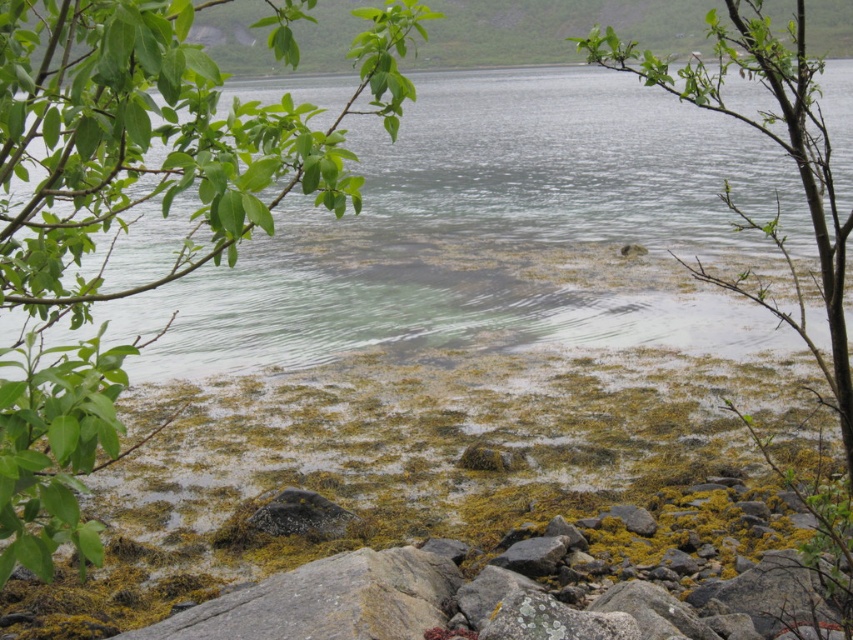
The width and height of the screenshot is (853, 640). What are the coordinates of `green algae at center` in the screenshot? It's located at (491, 230).

Image resolution: width=853 pixels, height=640 pixels. What do you see at coordinates (491, 230) in the screenshot?
I see `green algae at center` at bounding box center [491, 230].

Find the location of a particular element. Image resolution: width=853 pixels, height=640 pixels. green algae at center is located at coordinates (491, 230).

Identify the location of green algae at center. Image resolution: width=853 pixels, height=640 pixels. (491, 230).

Is green leafy branch at upper center to the left of gray rough rock at center from the viewer's perspective?

No, green leafy branch at upper center is not to the left of gray rough rock at center.

Can you confirm if green leafy branch at upper center is positioned to the right of gray rough rock at center?

Yes, green leafy branch at upper center is to the right of gray rough rock at center.

Where is `green leafy branch at upper center`? green leafy branch at upper center is located at coordinates (776, 198).

Between point (520, 83) and point (804, 312), which one is positioned behind?

The point (520, 83) is behind.

This screenshot has width=853, height=640. Describe the element at coordinates (491, 230) in the screenshot. I see `green algae at center` at that location.

Locate an element on the screen. The image size is (853, 640). green algae at center is located at coordinates (491, 230).

Image resolution: width=853 pixels, height=640 pixels. I want to click on green algae at center, so click(491, 230).